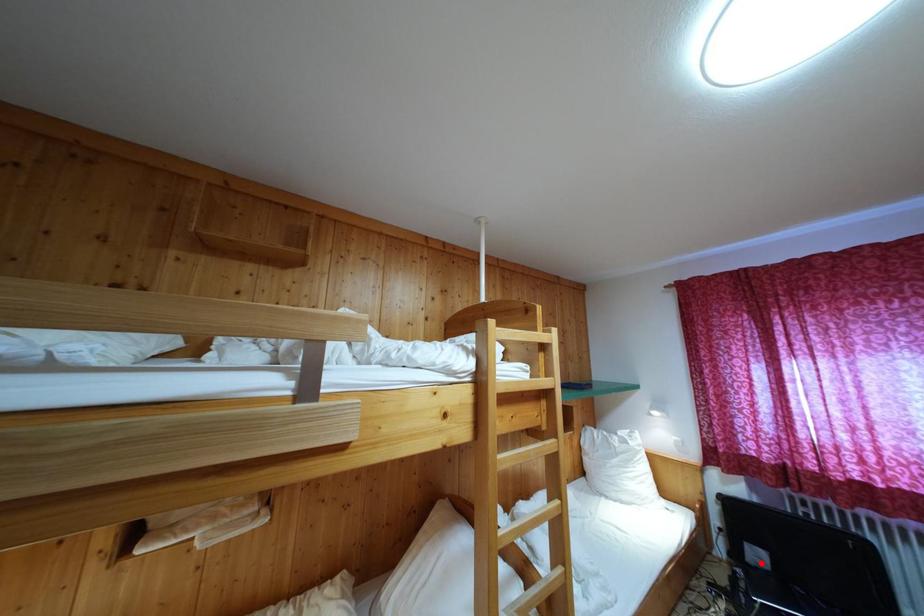
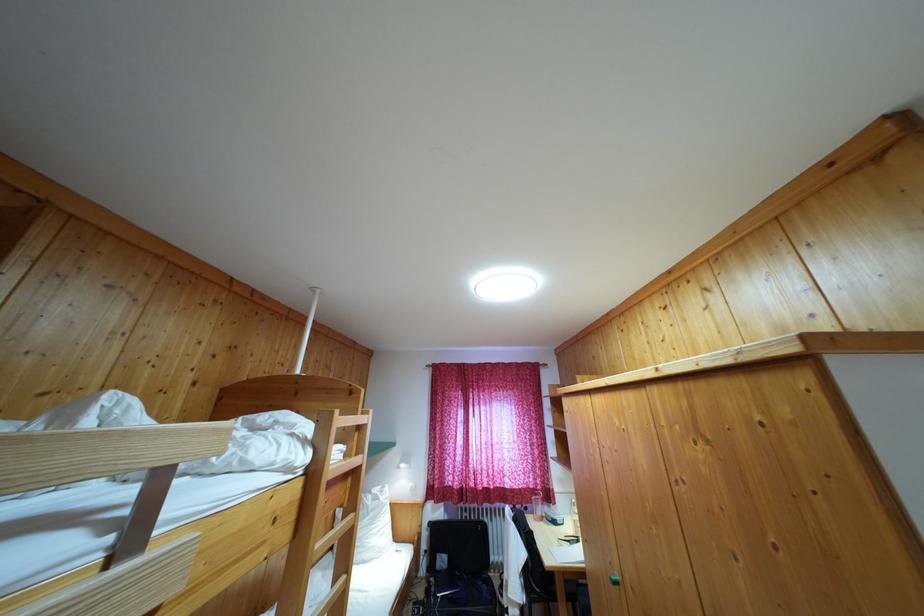
Where in the second image is the point corresponding to the highlighted location from the first image?

(445, 567)